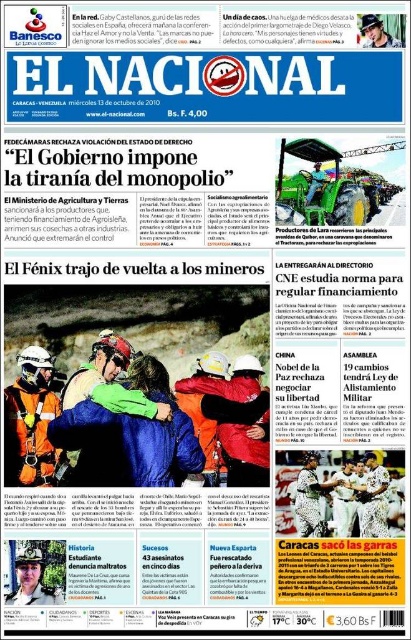
Does orange reflective safety vest at left appear under green fabric tractor at center?

Yes, orange reflective safety vest at left is below green fabric tractor at center.

Measure the distance between point (13, 412) and camera.

61.54 feet

I want to click on orange reflective safety vest at left, so click(30, 420).

Between green rubber tractor at center and smooth leather cap at upper right, which one has more height?

green rubber tractor at center

Does green rubber tractor at center appear over smooth leather cap at upper right?

Incorrect, green rubber tractor at center is not positioned above smooth leather cap at upper right.

Locate an element on the screen. The image size is (411, 640). green rubber tractor at center is located at coordinates (330, 186).

Where is `green rubber tractor at center`? green rubber tractor at center is located at coordinates (330, 186).

Who is more distant from viewer, (x=6, y=598) or (x=394, y=42)?

Positioned behind is point (x=394, y=42).

Who is lower down, matte black helmet at center or smooth leather cap at upper right?

matte black helmet at center is below.

Is point (23, 564) positioned before point (390, 38)?

No, (23, 564) is behind (390, 38).

At what (x,y) coordinates should I click in order to perform the action: click on matte black helmet at center. Please return your answer as a coordinate pair (x, y). The image size is (411, 640). Looking at the image, I should click on (30, 580).